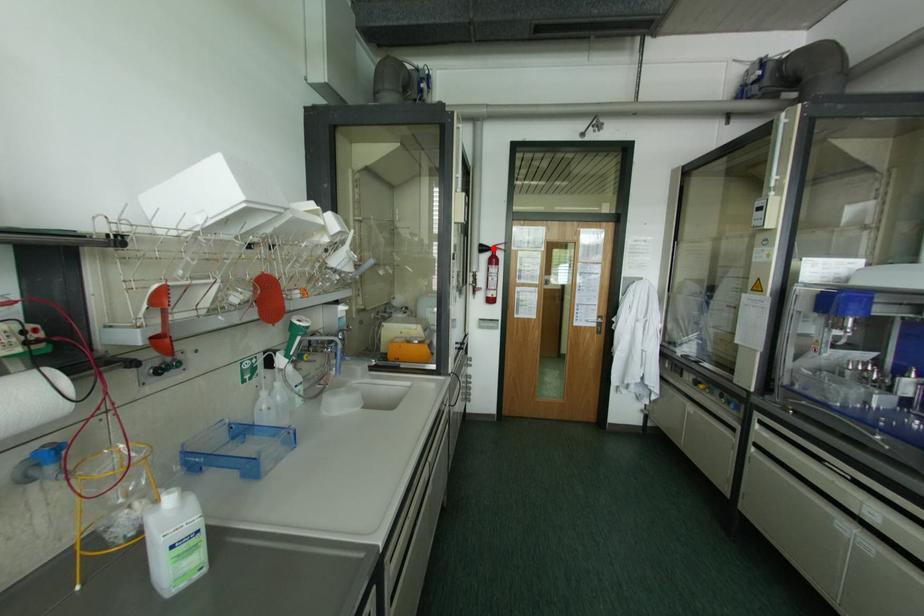
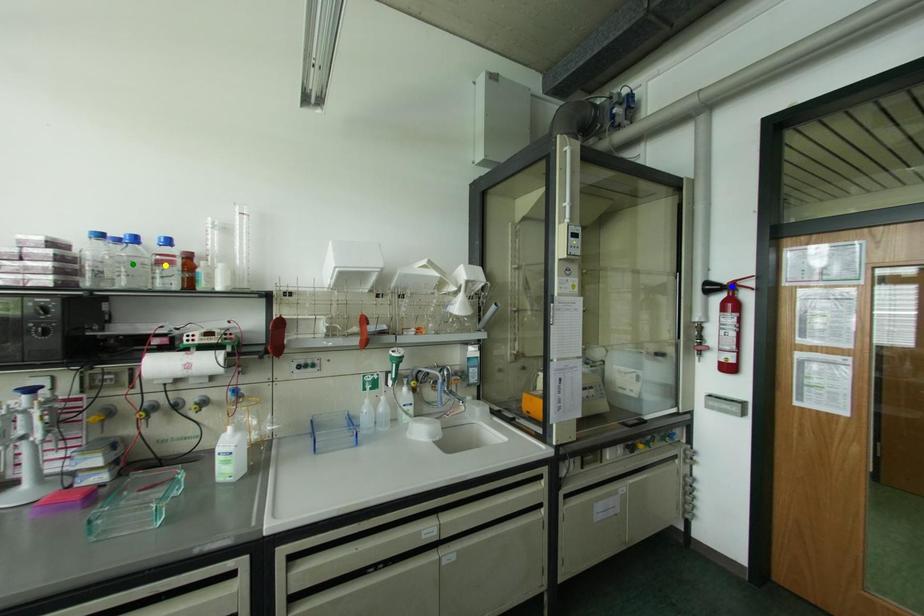
Question: I am providing you with two images of the same scene from different viewpoints. A red point is marked on the first image. You are given multiple points on the second image. Which point in image 2 represents the same 3d spot as the red point in image 1?

Choices:
 (A) green point
 (B) yellow point
 (C) blue point

Answer: (C)